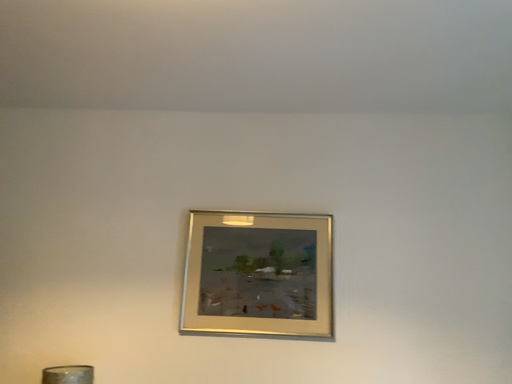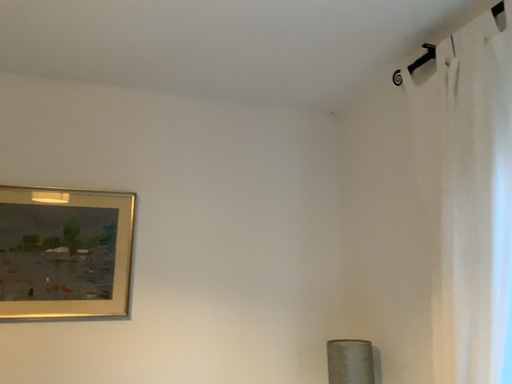
Question: How did the camera likely rotate when shooting the video?

Choices:
 (A) rotated right
 (B) rotated left

Answer: (A)